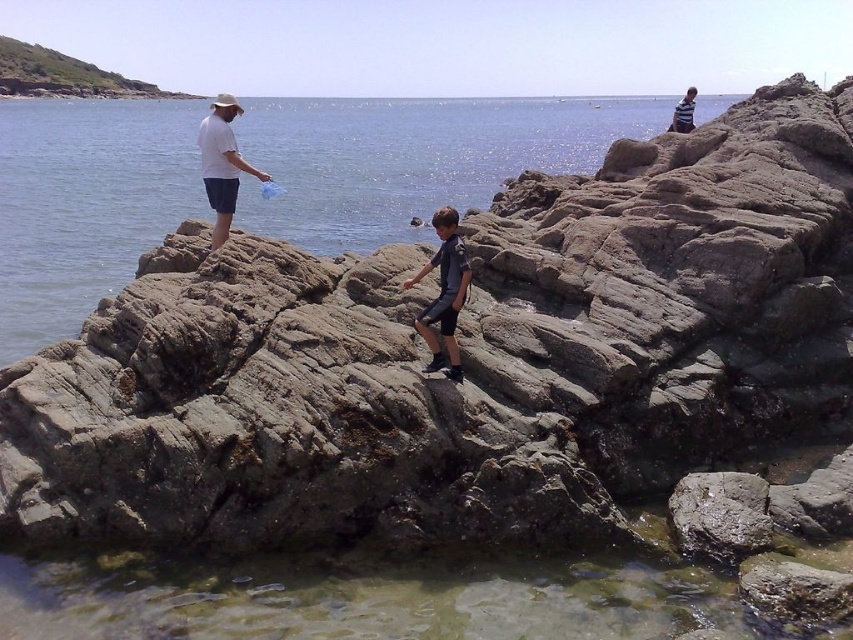
You are standing at point (432, 321) and want to walk to the water edge. Is the point (120, 83) behind you or in front of you?

Point (120, 83) is behind point (432, 321), so it is behind you.

You are a hiker who wants to cross the rocks to reach the water. You see the clear water at rocks center and the dark blue fabric shorts at center. Which object is higher up on the rocks?

The clear water at rocks center is taller than the dark blue fabric shorts at center, so the clear water at rocks center is higher up on the rocks.